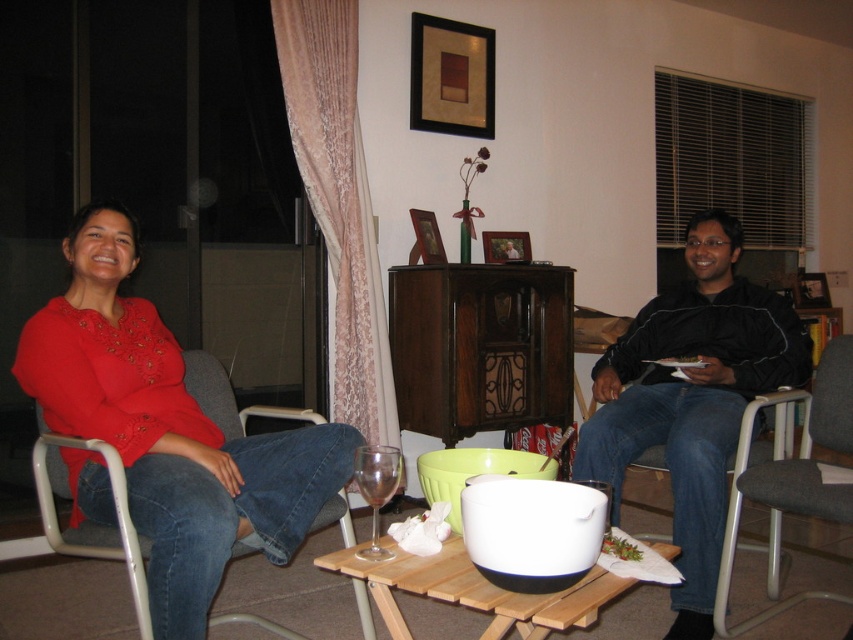
Between point (103, 454) and point (489, 627), which one is positioned behind?

The point (103, 454) is more distant.

Can you confirm if matte gray armchair at left is positioned to the right of wooden tray at center?

No, matte gray armchair at left is not to the right of wooden tray at center.

Where is `matte gray armchair at left`? This screenshot has width=853, height=640. matte gray armchair at left is located at coordinates (86, 520).

Which of these two, metallic gray armchair at right or matte gray armchair at left, stands shorter?

matte gray armchair at left is shorter.

Can you confirm if metallic gray armchair at right is positioned to the left of matte gray armchair at left?

No, metallic gray armchair at right is not to the left of matte gray armchair at left.

Find the location of `metallic gray armchair at right`. metallic gray armchair at right is located at coordinates (793, 477).

Image resolution: width=853 pixels, height=640 pixels. In order to click on metallic gray armchair at right in this screenshot , I will do `click(793, 477)`.

Can you confirm if metallic gray armchair at right is shorter than transparent glass wine glass at center?

In fact, metallic gray armchair at right may be taller than transparent glass wine glass at center.

Who is more forward, (784, 493) or (381, 468)?

Positioned in front is point (381, 468).

The height and width of the screenshot is (640, 853). I want to click on metallic gray armchair at right, so click(x=793, y=477).